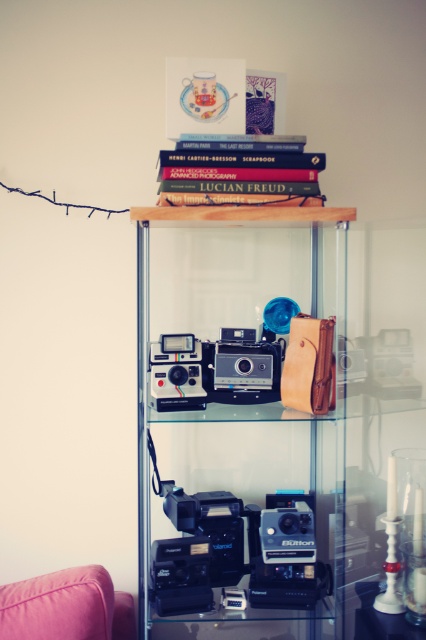
Question: Is pink fabric couch at lower left smaller than satin silver camera at center?

Choices:
 (A) yes
 (B) no

Answer: (B)

Question: In this image, where is hardcover book at upper center located relative to matte black camera at center?

Choices:
 (A) right
 (B) left

Answer: (A)

Question: Which of the following is the farthest from the observer?

Choices:
 (A) (226, 532)
 (B) (250, 188)
 (C) (166, 358)
 (D) (62, 605)

Answer: (A)

Question: Estimate the real-world distances between objects in this image. Which object is farther from the hardcover book at upper center?

Choices:
 (A) matte black camera at center
 (B) pink fabric couch at lower left

Answer: (B)

Question: Based on their relative distances, which object is farther from the transparent glass cabinet at center?

Choices:
 (A) pink fabric couch at lower left
 (B) matte black camera at center
 (C) satin silver camera at center
 (D) hardcover book at upper center

Answer: (D)

Question: Does transparent glass cabinet at center have a lesser width compared to hardcover book at upper center?

Choices:
 (A) no
 (B) yes

Answer: (A)